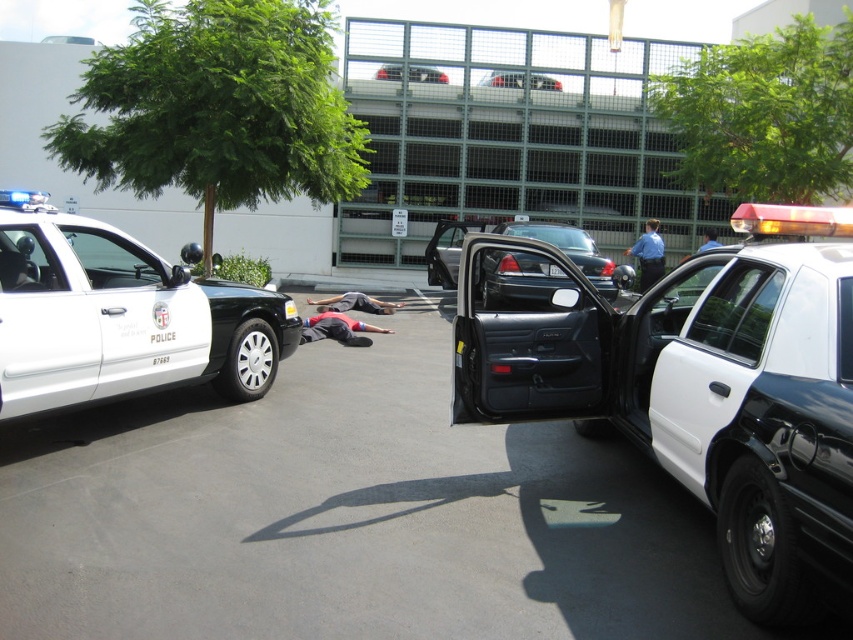
Question: Which point is farther from the camera taking this photo?

Choices:
 (A) (503, 77)
 (B) (300, 336)

Answer: (A)

Question: Based on their relative distances, which object is nearer to the red fabric body at center?

Choices:
 (A) metallic silver sedan at center
 (B) white glossy police car at left
 (C) shiny black sedan at center

Answer: (C)

Question: Does red fabric body at center have a larger size compared to gray fabric shirt at center?

Choices:
 (A) no
 (B) yes

Answer: (A)

Question: Is shiny black sedan at center bigger than metallic silver sedan at center?

Choices:
 (A) yes
 (B) no

Answer: (A)

Question: Which of the following is the farthest from the observer?

Choices:
 (A) (560, 84)
 (B) (653, 264)
 (C) (782, 600)

Answer: (A)

Question: Is white glossy police car at center behind white glossy police car at left?

Choices:
 (A) no
 (B) yes

Answer: (B)